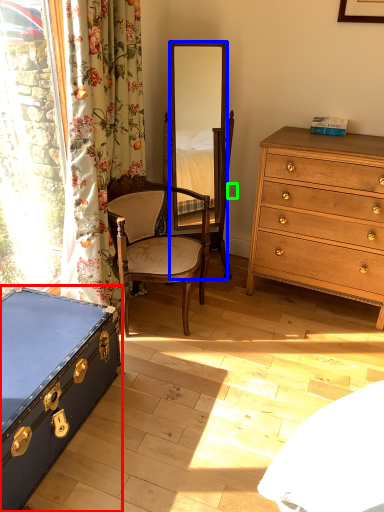
Question: Which is farther away from box (highlighted by a red box)? mirror (highlighted by a blue box) or power outlet (highlighted by a green box)?

Choices:
 (A) mirror
 (B) power outlet

Answer: (A)